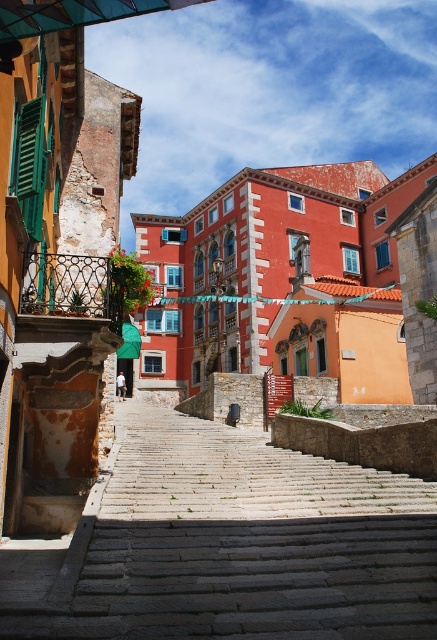
Is the position of black wrought iron balustrade at left less distant than that of green matte shutter at upper left?

No, it is not.

Is black wrought iron balustrade at left thinner than green matte shutter at upper left?

No.

Does point (86, 312) come farther from viewer compared to point (34, 173)?

Yes, point (86, 312) is behind point (34, 173).

Locate an element on the screen. The image size is (437, 640). black wrought iron balustrade at left is located at coordinates (70, 289).

Is red brick building at center to the left of green matte shutter at upper left from the viewer's perspective?

No, red brick building at center is not to the left of green matte shutter at upper left.

Who is more distant from viewer, [248,273] or [20,186]?

Positioned behind is point [248,273].

Where is `red brick building at center`? The image size is (437, 640). red brick building at center is located at coordinates (280, 282).

Is red brick building at center to the left of black wrought iron balustrade at left from the viewer's perspective?

In fact, red brick building at center is to the right of black wrought iron balustrade at left.

Is point (382, 188) positioned behind point (72, 273)?

Yes, it is.

The width and height of the screenshot is (437, 640). Describe the element at coordinates (280, 282) in the screenshot. I see `red brick building at center` at that location.

Where is `red brick building at center`? Image resolution: width=437 pixels, height=640 pixels. red brick building at center is located at coordinates (280, 282).